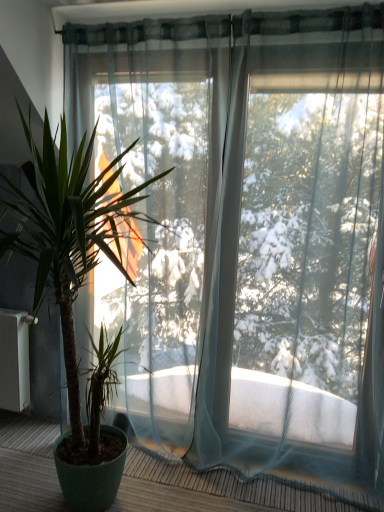
What do you see at coordinates (232, 486) in the screenshot? This screenshot has width=384, height=512. I see `transparent fabric balcony at lower left` at bounding box center [232, 486].

You are a GUI agent. You are given a task and a screenshot of the screen. Output one action in this format:
    pyautogui.click(x=<x>, y=<y>)
    Task: Click on the transparent fabric balcony at lower left
    
    Given the screenshot: What is the action you would take?
    pyautogui.click(x=232, y=486)

What is the approximate width of transparent fabric balcony at lower left?

It is 30.55 inches.

In order to face green glossy plant at left, should I rotate leftwards or rightwards?

It's best to rotate left around 16.627 degrees.

The image size is (384, 512). Find the location of `green glossy plant at left`. green glossy plant at left is located at coordinates (72, 276).

The width and height of the screenshot is (384, 512). What do you see at coordinates (72, 276) in the screenshot?
I see `green glossy plant at left` at bounding box center [72, 276].

This screenshot has height=512, width=384. In order to click on transparent fabric balcony at lower left in this screenshot , I will do `click(232, 486)`.

Does transparent fabric balcony at lower left appear on the left side of green glossy plant at left?

In fact, transparent fabric balcony at lower left is to the right of green glossy plant at left.

Between transparent fabric balcony at lower left and green glossy plant at left, which one is positioned behind?

transparent fabric balcony at lower left is behind.

Between point (243, 481) and point (105, 490), which one is positioned in front?

The point (105, 490) is closer.

From the image's perspective, who appears lower, transparent fabric balcony at lower left or green glossy plant at left?

From the image's view, transparent fabric balcony at lower left is below.

From a real-world perspective, is transparent fabric balcony at lower left physically above green glossy plant at left?

Incorrect, from a real-world perspective, transparent fabric balcony at lower left is lower than green glossy plant at left.

Between transparent fabric balcony at lower left and green glossy plant at left, which one has smaller width?

transparent fabric balcony at lower left.

Is transparent fabric balcony at lower left taller or shorter than green glossy plant at left?

transparent fabric balcony at lower left is shorter than green glossy plant at left.

Considering the sizes of objects transparent fabric balcony at lower left and green glossy plant at left in the image provided, who is bigger, transparent fabric balcony at lower left or green glossy plant at left?

green glossy plant at left.

Can green glossy plant at left be found inside transparent fabric balcony at lower left?

That's incorrect, green glossy plant at left is not inside transparent fabric balcony at lower left.

Is transparent fabric balcony at lower left not close to green glossy plant at left?

Indeed, transparent fabric balcony at lower left is not near green glossy plant at left.

Is transparent fabric balcony at lower left positioned with its back to green glossy plant at left?

Yes, transparent fabric balcony at lower left is positioned with its back facing green glossy plant at left.

In order to click on houseplant above the transparent fabric balcony at lower left (from the image's perspective) in this screenshot , I will do `click(72, 276)`.

Can you confirm if green glossy plant at left is positioned to the left of transparent fabric balcony at lower left?

Yes, green glossy plant at left is to the left of transparent fabric balcony at lower left.

Is green glossy plant at left in front of or behind transparent fabric balcony at lower left in the image?

In the image, green glossy plant at left appears in front of transparent fabric balcony at lower left.

Which is behind, point (45, 262) or point (319, 509)?

Point (319, 509)

From the image's perspective, between green glossy plant at left and transparent fabric balcony at lower left, which one is located above?

green glossy plant at left.

From a real-world perspective, is green glossy plant at left positioned over transparent fabric balcony at lower left based on gravity?

Yes, from a real-world perspective, green glossy plant at left is above transparent fabric balcony at lower left.

Does green glossy plant at left have a lesser width compared to transparent fabric balcony at lower left?

Incorrect, the width of green glossy plant at left is not less than that of transparent fabric balcony at lower left.

From their relative heights in the image, would you say green glossy plant at left is taller or shorter than transparent fabric balcony at lower left?

In the image, green glossy plant at left appears to be taller than transparent fabric balcony at lower left.

Is green glossy plant at left bigger than transparent fabric balcony at lower left?

Yes.

Choose the correct answer: Is green glossy plant at left inside transparent fabric balcony at lower left or outside it?

The correct answer is: outside.

Is green glossy plant at left touching transparent fabric balcony at lower left?

No.

Is green glossy plant at left aimed at transparent fabric balcony at lower left?

No, green glossy plant at left is not oriented towards transparent fabric balcony at lower left.

Where is `houseplant on the left of transparent fabric balcony at lower left`? houseplant on the left of transparent fabric balcony at lower left is located at coordinates (72, 276).

The height and width of the screenshot is (512, 384). In order to click on houseplant above the transparent fabric balcony at lower left (from a real-world perspective) in this screenshot , I will do `click(72, 276)`.

Locate an element on the screen. houseplant located above the transparent fabric balcony at lower left (from the image's perspective) is located at coordinates (72, 276).